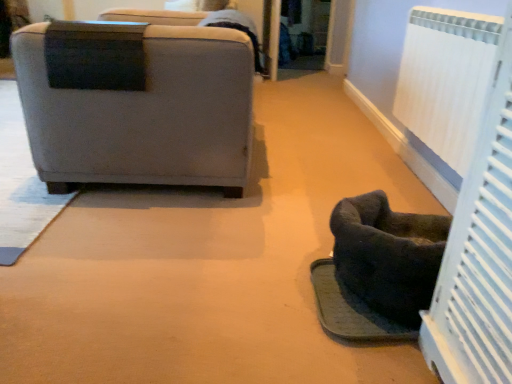
Question: Can you confirm if dark gray fabric footrest at lower right is shorter than gray fabric chair at left?

Choices:
 (A) yes
 (B) no

Answer: (A)

Question: Is dark gray fabric footrest at lower right turned away from gray fabric chair at left?

Choices:
 (A) yes
 (B) no

Answer: (B)

Question: Does dark gray fabric footrest at lower right have a lesser width compared to gray fabric chair at left?

Choices:
 (A) yes
 (B) no

Answer: (A)

Question: Is dark gray fabric footrest at lower right with gray fabric chair at left?

Choices:
 (A) yes
 (B) no

Answer: (B)

Question: Is dark gray fabric footrest at lower right to the right of gray fabric chair at left from the viewer's perspective?

Choices:
 (A) yes
 (B) no

Answer: (A)

Question: Based on their positions, is dark gray fabric footrest at lower right located to the left or right of white textured radiator at right?

Choices:
 (A) left
 (B) right

Answer: (A)

Question: In the image, is dark gray fabric footrest at lower right positioned in front of or behind white textured radiator at right?

Choices:
 (A) front
 (B) behind

Answer: (A)

Question: Looking at their shapes, would you say dark gray fabric footrest at lower right is wider or thinner than white textured radiator at right?

Choices:
 (A) wide
 (B) thin

Answer: (A)

Question: Is dark gray fabric footrest at lower right situated inside white textured radiator at right or outside?

Choices:
 (A) outside
 (B) inside

Answer: (A)

Question: Based on their sizes in the image, would you say gray fabric chair at left is bigger or smaller than dark gray fabric footrest at lower right?

Choices:
 (A) big
 (B) small

Answer: (A)

Question: Is gray fabric chair at left inside the boundaries of dark gray fabric footrest at lower right, or outside?

Choices:
 (A) inside
 (B) outside

Answer: (B)

Question: Does point (146, 144) appear closer or farther from the camera than point (392, 326)?

Choices:
 (A) closer
 (B) farther

Answer: (B)

Question: From a real-world perspective, is gray fabric chair at left above or below dark gray fabric footrest at lower right?

Choices:
 (A) below
 (B) above

Answer: (B)

Question: In the image, is dark fabric pet bed at lower right on the left side or the right side of dark gray fabric footrest at lower right?

Choices:
 (A) left
 (B) right

Answer: (B)

Question: From a real-world perspective, is dark fabric pet bed at lower right positioned above or below dark gray fabric footrest at lower right?

Choices:
 (A) below
 (B) above

Answer: (B)